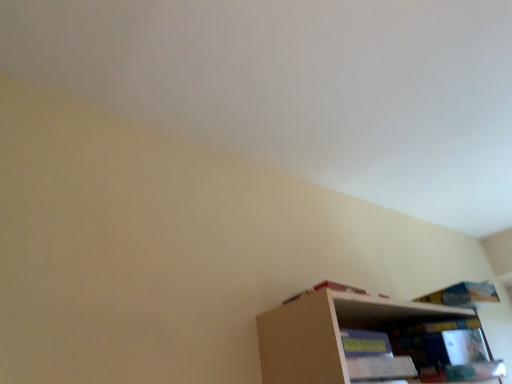
Question: Visually, is wooden bookshelf at lower right positioned to the left or to the right of blue paper book at upper right, marked as the first book in a right-to-left arrangement?

Choices:
 (A) left
 (B) right

Answer: (A)

Question: From a real-world perspective, is wooden bookshelf at lower right physically located above or below blue paper book at upper right, marked as the first book in a right-to-left arrangement?

Choices:
 (A) above
 (B) below

Answer: (B)

Question: Estimate the real-world distances between objects in this image. Which object is farther from the wooden bookshelf at lower right?

Choices:
 (A) blue paper book at upper right, which appears as the 2th book when viewed from the left
 (B) white cardboard book at upper right, which is the first book in left-to-right order

Answer: (B)

Question: Estimate the real-world distances between objects in this image. Which object is farther from the blue paper book at upper right, which appears as the 2th book when viewed from the left?

Choices:
 (A) wooden bookshelf at lower right
 (B) white cardboard book at upper right, which is the first book in left-to-right order

Answer: (B)